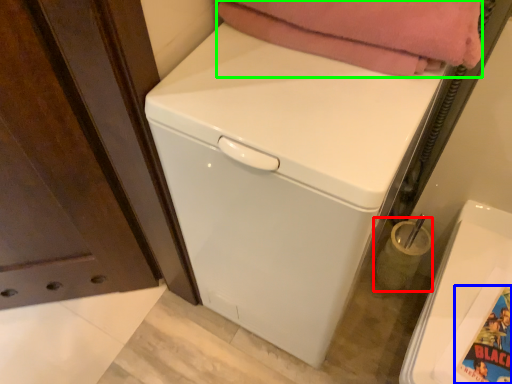
Question: Considering the real-world distances, which object is farthest from appliance (highlighted by a red box)? comic book character (highlighted by a blue box) or blanket (highlighted by a green box)?

Choices:
 (A) comic book character
 (B) blanket

Answer: (B)